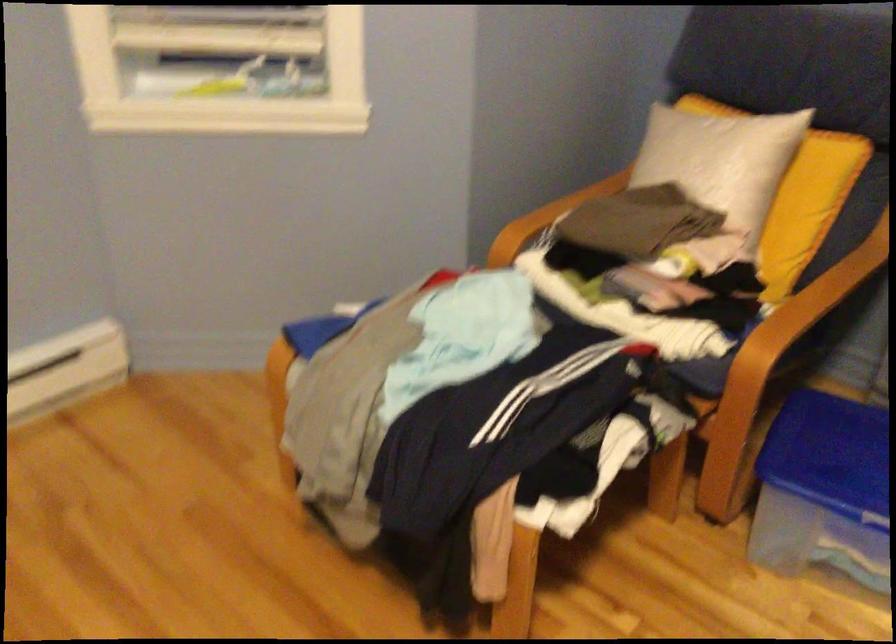
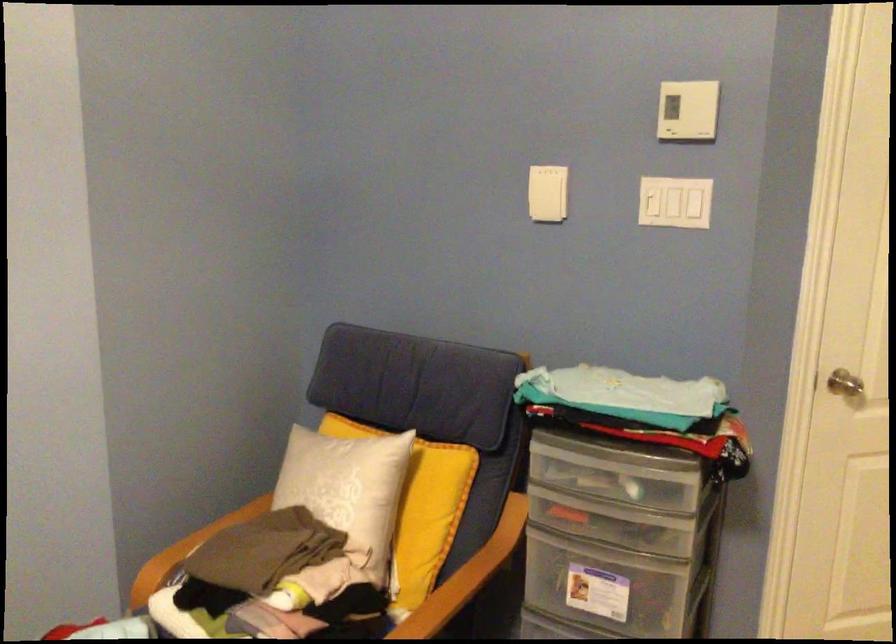
Find the pixel in the second image that matches [728,167] in the first image.

(348, 488)